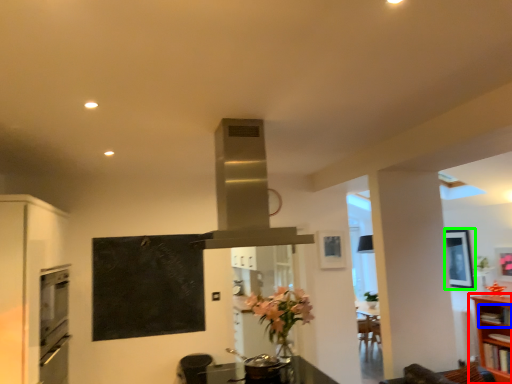
Question: Estimate the real-world distances between objects in this image. Which object is closer to shelf (highlighted by a red box), shelf (highlighted by a blue box) or picture frame (highlighted by a green box)?

Choices:
 (A) shelf
 (B) picture frame

Answer: (A)